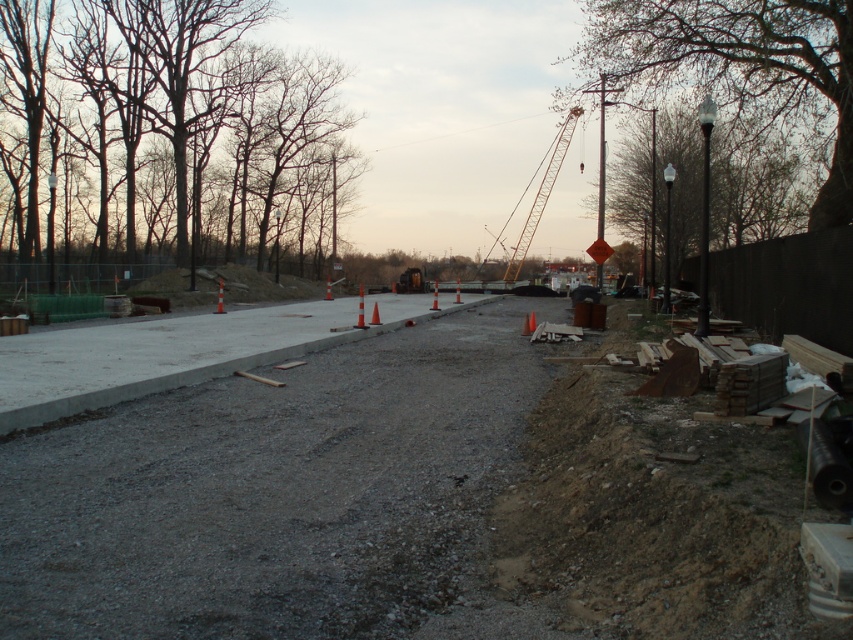
Who is positioned more to the right, green leafy tree at upper right or smooth gray tree at right?

From the viewer's perspective, smooth gray tree at right appears more on the right side.

Image resolution: width=853 pixels, height=640 pixels. What do you see at coordinates (738, 60) in the screenshot? I see `green leafy tree at upper right` at bounding box center [738, 60].

Locate an element on the screen. This screenshot has width=853, height=640. green leafy tree at upper right is located at coordinates (738, 60).

Is gray concrete pavement at center positioned in front of brown bark trees at upper left?

Yes, gray concrete pavement at center is in front of brown bark trees at upper left.

Between point (460, 419) and point (204, 6), which one is positioned in front?

Point (460, 419) is in front.

Is point (207, 500) behind point (108, 90)?

No.

Find the location of a particular element. This screenshot has width=853, height=640. gray concrete pavement at center is located at coordinates (403, 504).

Can you confirm if brown bark trees at upper left is wider than yellow metallic crane at center?

Yes, brown bark trees at upper left is wider than yellow metallic crane at center.

Can you confirm if brown bark trees at upper left is positioned above yellow metallic crane at center?

Indeed, brown bark trees at upper left is positioned over yellow metallic crane at center.

Which is in front, point (189, 220) or point (534, 218)?

Positioned in front is point (189, 220).

You are a GUI agent. You are given a task and a screenshot of the screen. Output one action in this format:
    pyautogui.click(x=<x>, y=<y>)
    Task: Click on the brown bark trees at upper left
    The image size is (853, 640).
    Given the screenshot: What is the action you would take?
    pyautogui.click(x=163, y=138)